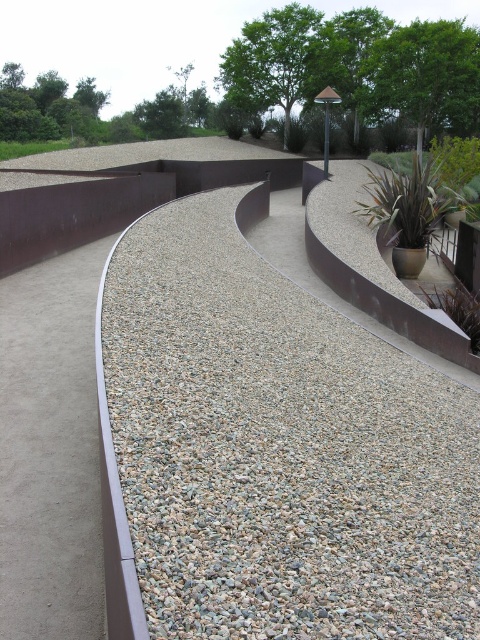
Which is behind, point (250, 360) or point (2, 150)?

Point (2, 150)

Is point (214, 513) closer to viewer compared to point (33, 154)?

Yes, point (214, 513) is in front of point (33, 154).

Where is `gray gravel at center`? gray gravel at center is located at coordinates (278, 445).

Looking at this image, is purple leafy plant at center-right wider than green leafy plant at upper left?

Incorrect, purple leafy plant at center-right's width does not surpass green leafy plant at upper left's.

Is purple leafy plant at center-right smaller than green leafy plant at upper left?

Correct, purple leafy plant at center-right occupies less space than green leafy plant at upper left.

Is point (476, 349) in front of point (33, 150)?

Yes, it is.

Where is `purple leafy plant at center-right`? The image size is (480, 640). purple leafy plant at center-right is located at coordinates (457, 308).

Can you confirm if gray gravel at center is wider than purple leafy plant at center-right?

In fact, gray gravel at center might be narrower than purple leafy plant at center-right.

Between gray gravel at center and purple leafy plant at center-right, which one appears on the left side from the viewer's perspective?

gray gravel at center is more to the left.

I want to click on gray gravel at center, so click(x=278, y=445).